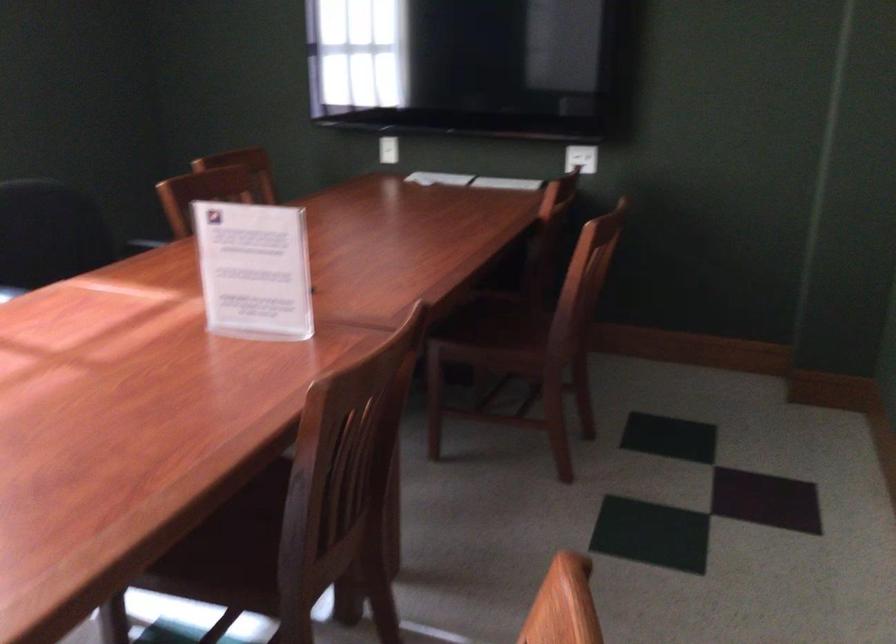
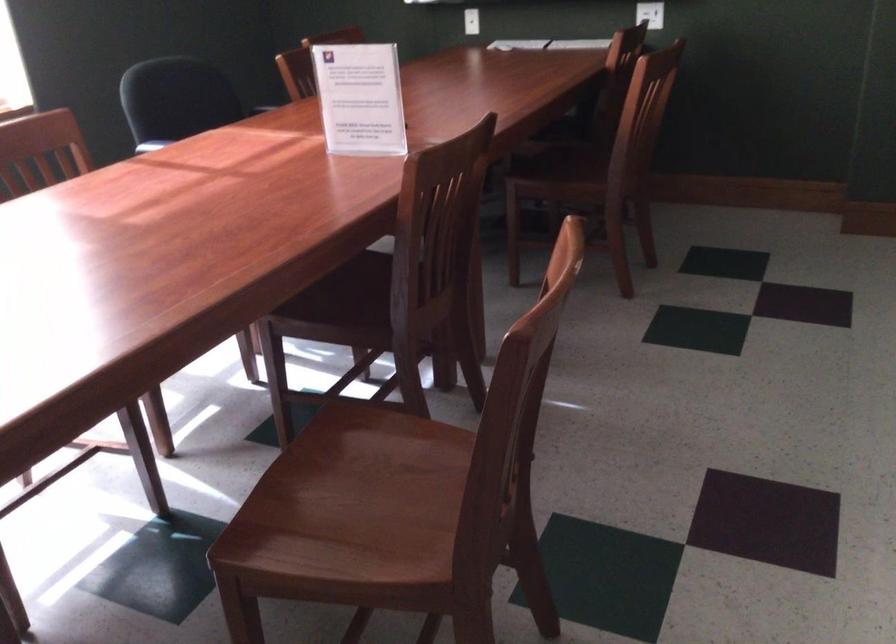
Find the pixel in the second image that matches point (213, 538) in the first image.

(340, 301)